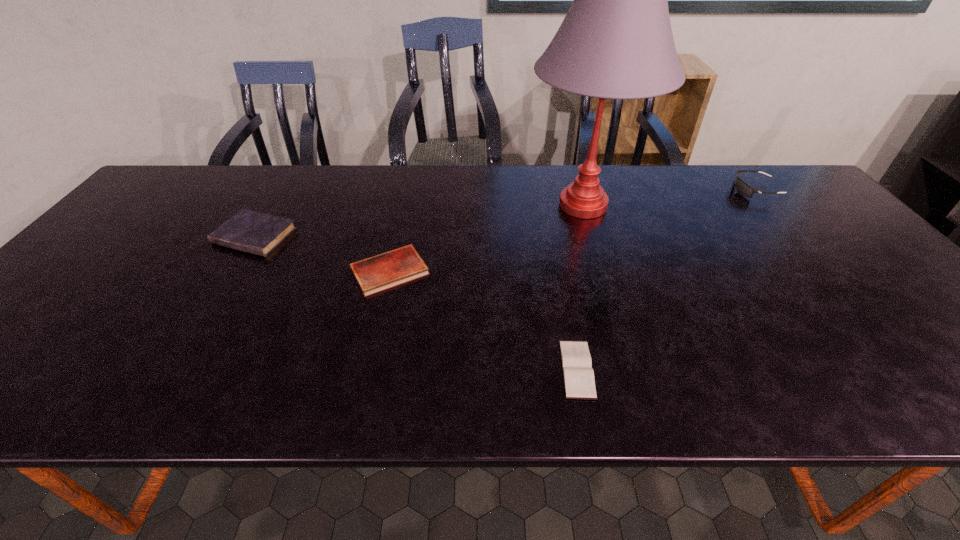
Where is `free space between the second tallest object and the second diary from right to left`? free space between the second tallest object and the second diary from right to left is located at coordinates (x=572, y=231).

You are a GUI agent. You are given a task and a screenshot of the screen. Output one action in this format:
    pyautogui.click(x=<x>, y=<y>)
    Task: Click on the empty space that is in between the second diary from left to right and the tallest object
    
    Given the screenshot: What is the action you would take?
    tap(487, 238)

I want to click on free point between the second tallest object and the nearest diary, so 665,280.

Find the location of a particular element. This screenshot has height=540, width=960. vacant space in between the table lamp and the leftmost object is located at coordinates (419, 221).

Where is `unoccupied area between the goggles and the second object from left to right`? The width and height of the screenshot is (960, 540). unoccupied area between the goggles and the second object from left to right is located at coordinates (572, 231).

Find the location of a particular element. Image resolution: width=960 pixels, height=540 pixels. free space that is in between the tallest object and the second object from left to right is located at coordinates (487, 238).

At what (x,y) coordinates should I click in order to perform the action: click on free spot between the goggles and the fourth object from right to left. Please return your answer as a coordinate pair (x, y). Looking at the image, I should click on (572, 231).

Identify the location of free space between the fourth shortest object and the tallest object. The height and width of the screenshot is (540, 960). (669, 198).

The height and width of the screenshot is (540, 960). I want to click on object that is the fourth closest to the table lamp, so click(258, 233).

Select which object appears as the fourth closest to the table lamp. Please provide its 2D coordinates. Your answer should be formatted as a tuple, i.e. [(x, y)], where the tuple contains the x and y coordinates of a point satisfying the conditions above.

[(258, 233)]